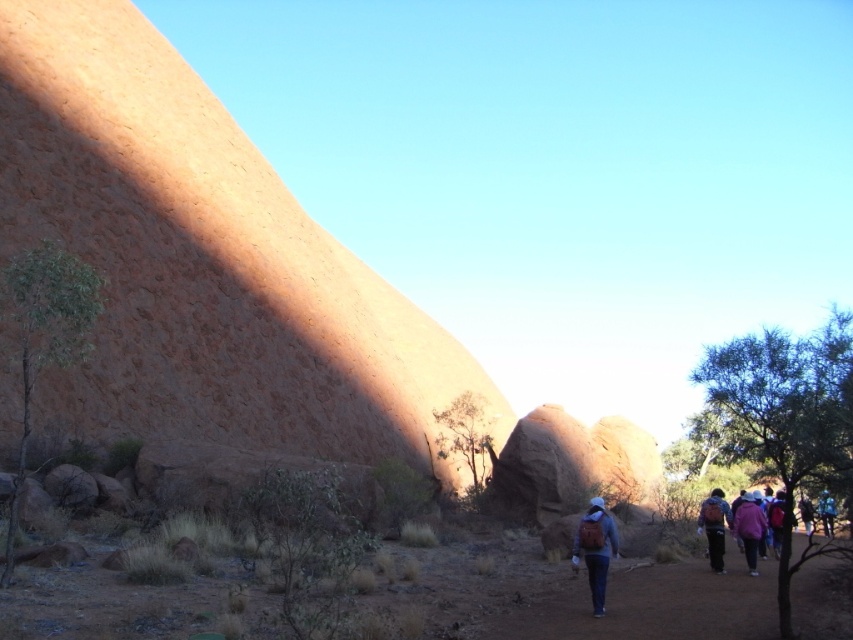
You are a hiker who needs to locate your items. You see the matte blue backpack at center and the matte pink jacket at center. Which item is positioned more to the left?

The matte blue backpack at center is positioned to the left of the matte pink jacket at center, so the matte blue backpack at center is more to the left.

You are a hiker trying to decide whether to place your matte pink jacket at center on top of your matte blue backpack at center. Based on their positions in the image, can you do this without moving the backpack?

The matte pink jacket at center is behind the matte blue backpack at center, so it is already positioned behind the backpack. To place the jacket on top of the backpack, you would need to move the backpack out of the way first.